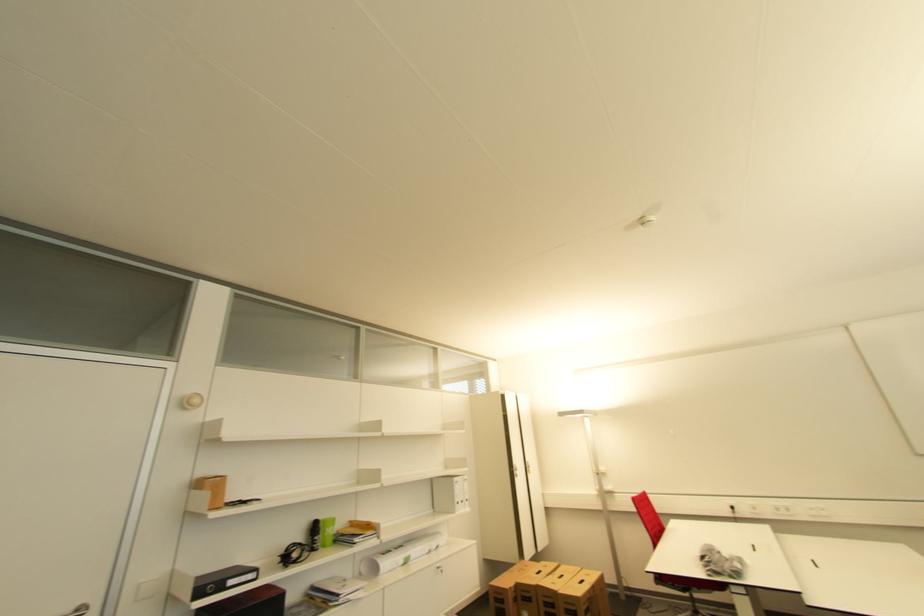
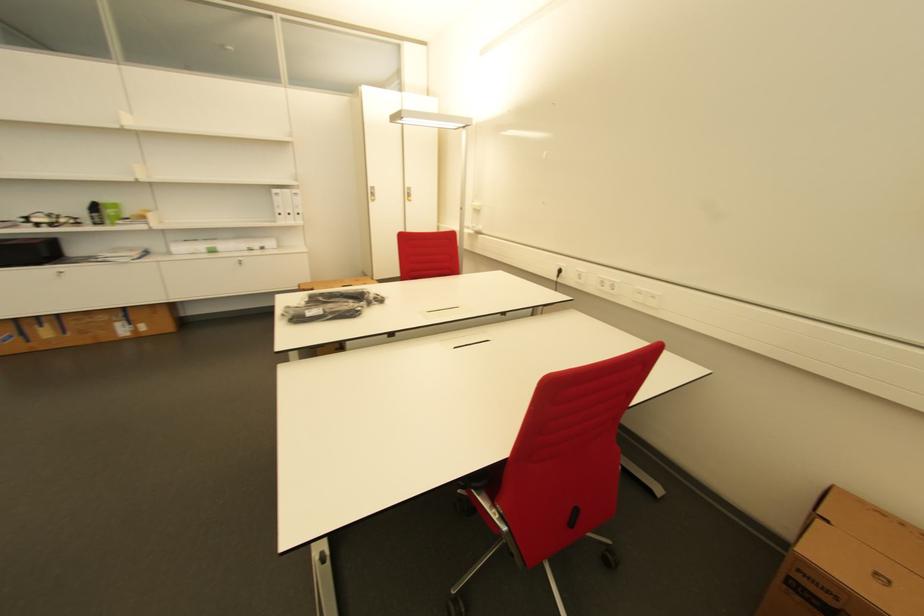
In the second image, find the point that corresponds to point (829, 511) in the first image.

(659, 299)